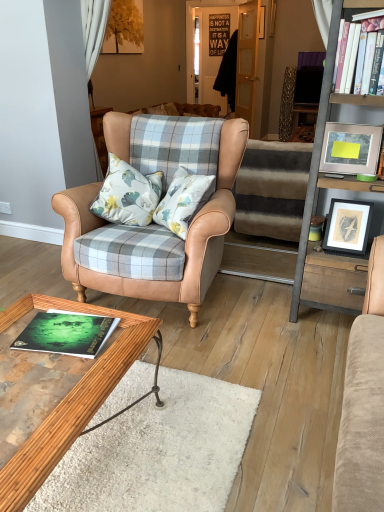
Question: Does striped carpet at center turn towards wooden polished coffee table at lower left?

Choices:
 (A) yes
 (B) no

Answer: (B)

Question: Is wooden polished coffee table at lower left completely or partially inside striped carpet at center?

Choices:
 (A) yes
 (B) no

Answer: (B)

Question: Does striped carpet at center have a larger size compared to wooden polished coffee table at lower left?

Choices:
 (A) yes
 (B) no

Answer: (A)

Question: From the image's perspective, is striped carpet at center over wooden polished coffee table at lower left?

Choices:
 (A) yes
 (B) no

Answer: (A)

Question: Is striped carpet at center outside wooden polished coffee table at lower left?

Choices:
 (A) yes
 (B) no

Answer: (A)

Question: Is metallic gray ladder at right situated inside wooden framed print at right, which is counted as the second picture frame, starting from the top, or outside?

Choices:
 (A) inside
 (B) outside

Answer: (B)

Question: From a real-world perspective, is metallic gray ladder at right physically located above or below wooden framed print at right, which is counted as the second picture frame, starting from the top?

Choices:
 (A) above
 (B) below

Answer: (A)

Question: From the image's perspective, is metallic gray ladder at right above or below wooden framed print at right, which is counted as the second picture frame, starting from the top?

Choices:
 (A) above
 (B) below

Answer: (A)

Question: Based on their sizes in the image, would you say metallic gray ladder at right is bigger or smaller than wooden framed print at right, the 1th picture frame ordered from the bottom?

Choices:
 (A) big
 (B) small

Answer: (A)

Question: Is white hardcover book at upper right, marked as the 2th book in a front-to-back arrangement, in front of or behind matte white picture frame at upper right, placed as the 1th picture frame when sorted from top to bottom, in the image?

Choices:
 (A) front
 (B) behind

Answer: (A)

Question: Considering the positions of white hardcover book at upper right, acting as the first book starting from the back, and matte white picture frame at upper right, which is the second picture frame from bottom to top, in the image, is white hardcover book at upper right, acting as the first book starting from the back, taller or shorter than matte white picture frame at upper right, which is the second picture frame from bottom to top,?

Choices:
 (A) short
 (B) tall

Answer: (B)

Question: Looking at their shapes, would you say white hardcover book at upper right, the first book viewed from the right, is wider or thinner than matte white picture frame at upper right, placed as the 1th picture frame when sorted from top to bottom?

Choices:
 (A) thin
 (B) wide

Answer: (B)

Question: Visually, is white hardcover book at upper right, the first book viewed from the right, positioned to the left or to the right of matte white picture frame at upper right, placed as the 1th picture frame when sorted from top to bottom?

Choices:
 (A) left
 (B) right

Answer: (B)

Question: Is point (374, 139) closer or farther from the camera than point (355, 34)?

Choices:
 (A) farther
 (B) closer

Answer: (A)

Question: Considering the positions of matte white picture frame at upper right, which is the second picture frame from bottom to top, and white hardcover book at upper right, positioned as the 2th book in bottom-to-top order, in the image, is matte white picture frame at upper right, which is the second picture frame from bottom to top, taller or shorter than white hardcover book at upper right, positioned as the 2th book in bottom-to-top order,?

Choices:
 (A) tall
 (B) short

Answer: (B)